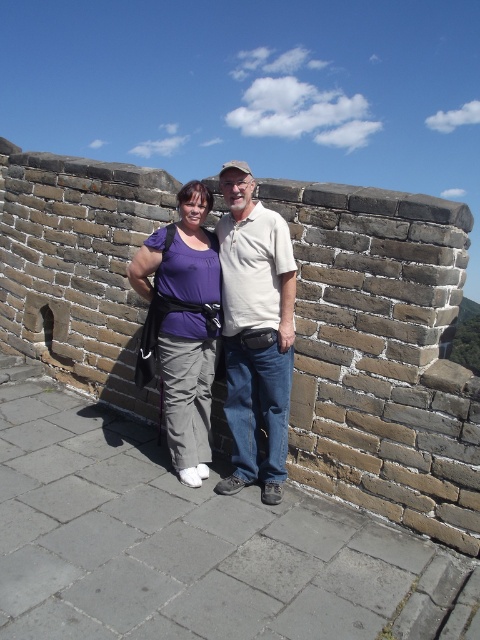
You are a photographer trying to capture both the white cotton shirt at center and the purple fabric pants at center in a single frame. Which object should you focus on first to ensure both are in the frame?

The white cotton shirt at center is smaller than the purple fabric pants at center, so you should focus on the purple fabric pants at center first to ensure both are in the frame.

You are a photographer planning to take a group photo of the purple cotton shirt at center and the white cotton shirt at center on the Great Wall. To ensure both subjects are in focus, you need to know their height difference. Which of the two is taller?

The purple cotton shirt at center is taller than the white cotton shirt at center.

You are a photographer trying to capture a group photo of two people standing on the Great Wall. You notice the purple cotton shirt at center and the white cotton shirt at center. Given that your camera has a minimum focus distance of 1.5 inches, can you focus on both shirts simultaneously?

The purple cotton shirt at center is 1.72 inches away from white cotton shirt at center. Since the distance between them is greater than the camera minimum focus distance of 1.5 inches, the camera can focus on both shirts simultaneously.